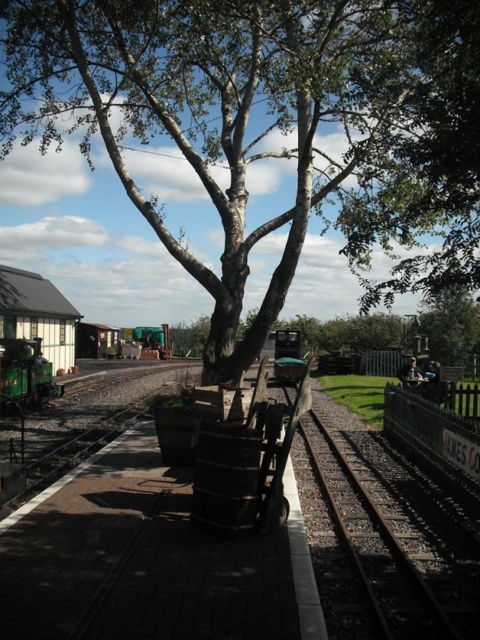
You are a passenger waiting at the station and need to board the green matte train at left. The tree might block your path. Is the green leafy tree at center in your way?

The green leafy tree at center is to the right of the green matte train at left, so it is not blocking your path to the train. You can proceed safely to board the green matte train at left without obstruction from the tree.

You are a photographer standing on the platform and want to capture both the green leafy tree at center and the green matte train at left in a single photo. Which object should you position closer to the camera to ensure both are fully visible in the frame?

To ensure both the green leafy tree at center and the green matte train at left are fully visible in the frame, you should position the green leafy tree at center closer to the camera since it is taller than the green matte train at left.